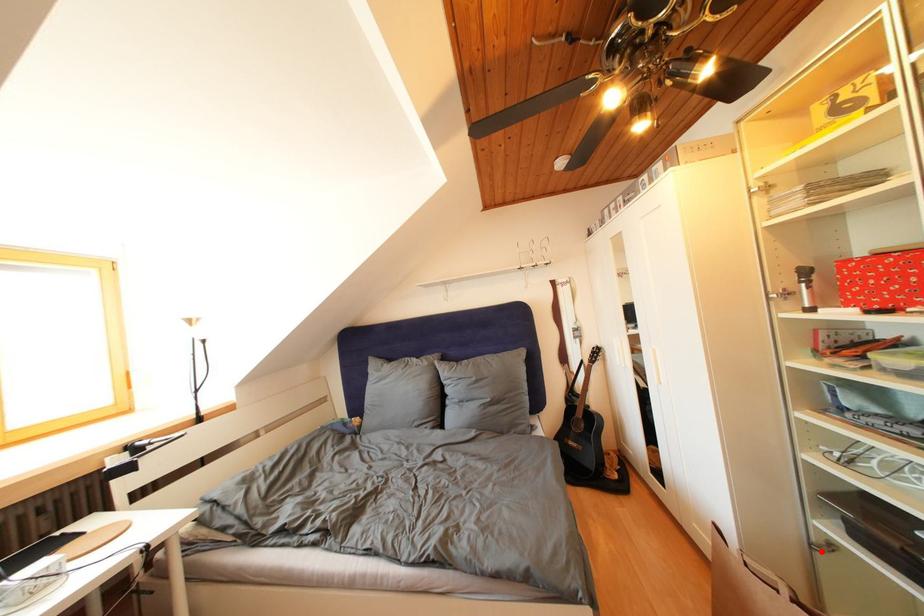
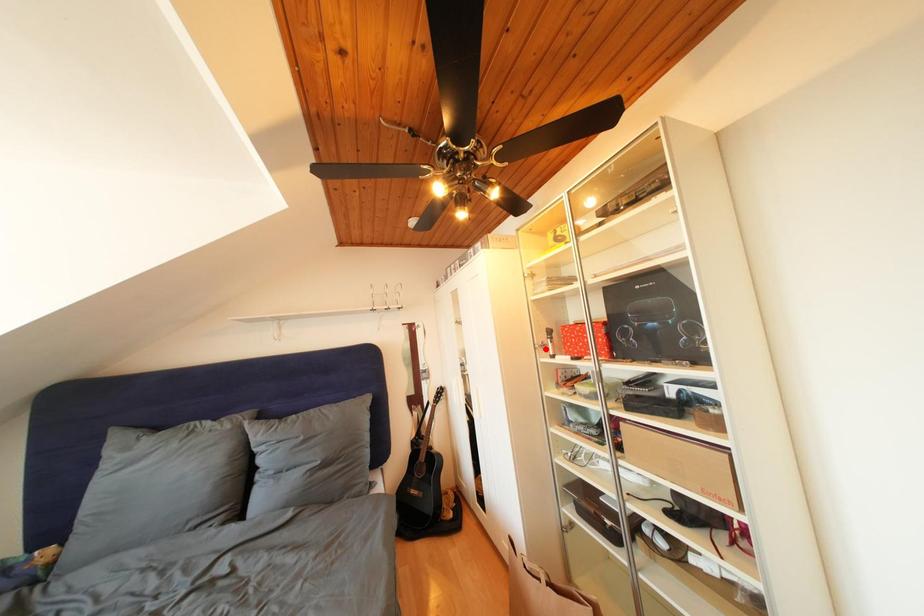
I am providing you with two images of the same scene from different viewpoints. A red point is marked on the first image and another point is marked on the second image. Does the point marked in image1 correspond to the same location as the one in image2?

No